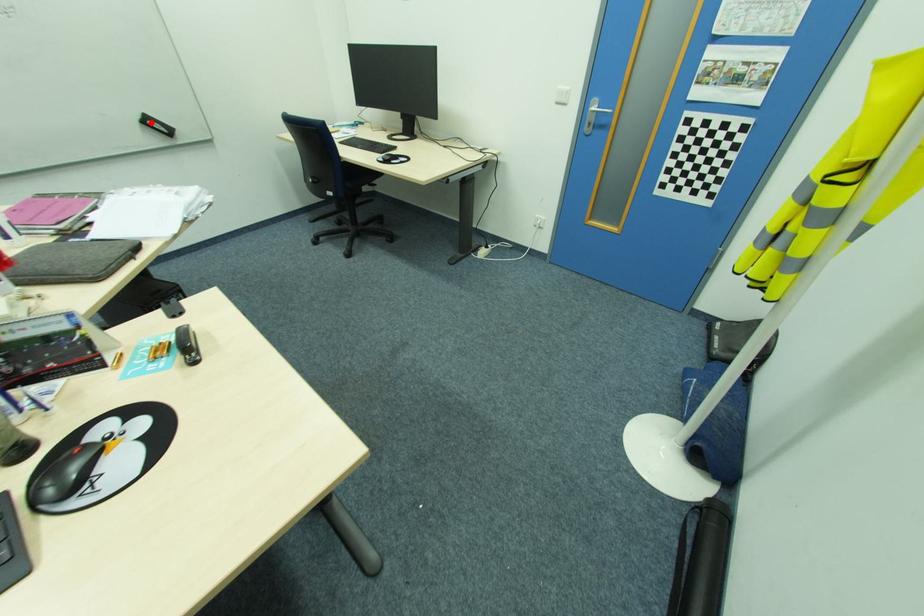
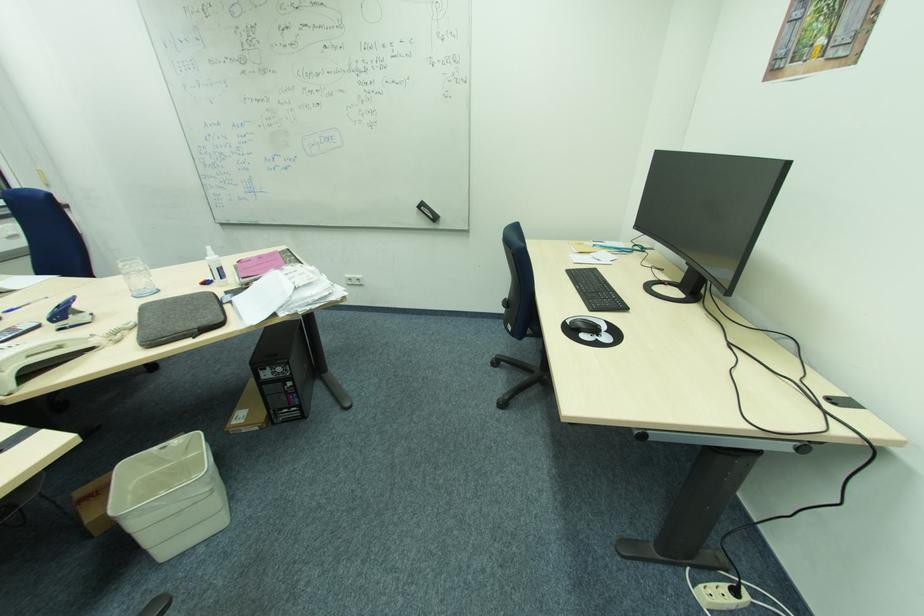
Question: A red point is marked in image1. In image2, is the corresponding 3D point closer to the camera or farther? Reply with the corresponding letter.

Choices:
 (A) The corresponding 3D point is closer.
 (B) The corresponding 3D point is farther.

Answer: (A)